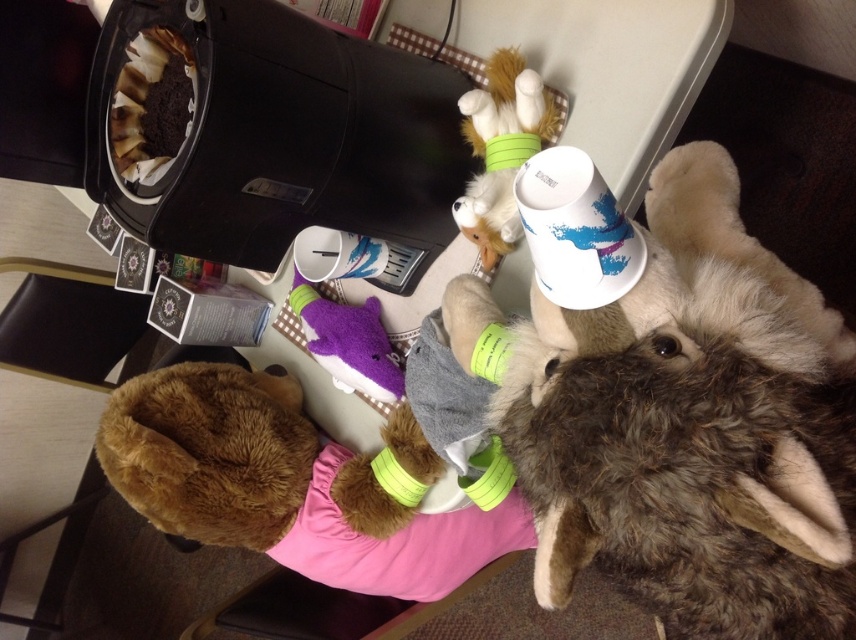
Does point (660, 593) lie behind point (471, 132)?

That is False.

Can you confirm if fluffy brown plush at upper right is positioned below fuzzy yellow toy at upper center?

Indeed, fluffy brown plush at upper right is positioned under fuzzy yellow toy at upper center.

Is point (803, 396) farther from camera compared to point (520, 74)?

No, it is in front of (520, 74).

Find the location of a particular element. fluffy brown plush at upper right is located at coordinates (694, 486).

Measure the distance from fluffy brown plush at upper right to purple plush toy at center.

They are 22.40 inches apart.

Is fluffy brown plush at upper right taller than purple plush toy at center?

Yes.

Describe the element at coordinates (694, 486) in the screenshot. This screenshot has height=640, width=856. I see `fluffy brown plush at upper right` at that location.

Locate an element on the screen. fluffy brown plush at upper right is located at coordinates (694, 486).

Who is positioned more to the right, fuzzy yellow toy at upper center or purple plush toy at center?

fuzzy yellow toy at upper center is more to the right.

In order to click on fuzzy yellow toy at upper center in this screenshot , I will do `click(501, 148)`.